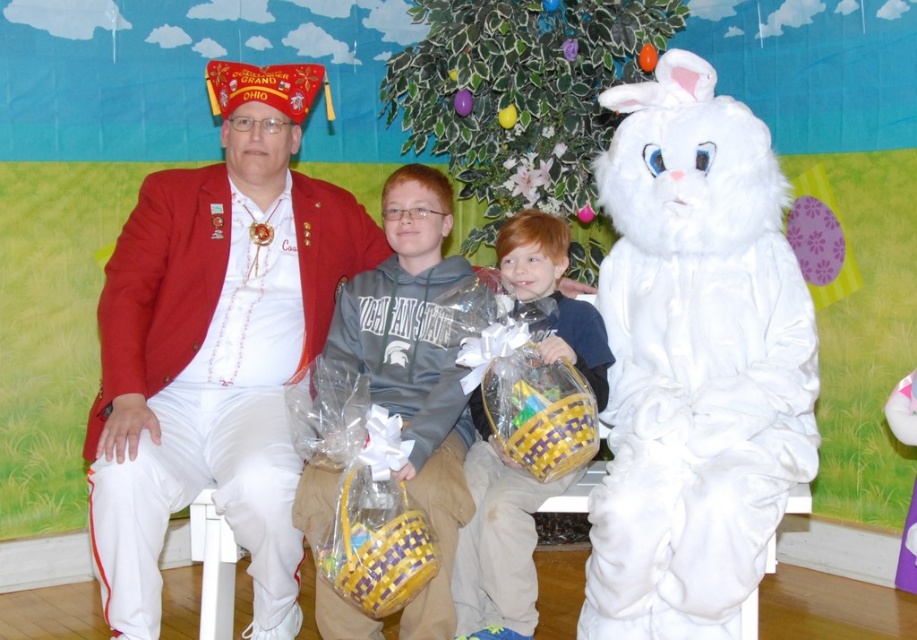
Question: Which of the following is the farthest from the observer?

Choices:
 (A) (648, 246)
 (B) (556, 260)
 (C) (288, 68)
 (D) (427, 340)

Answer: (B)

Question: Which of the following is the closest to the observer?

Choices:
 (A) (164, 381)
 (B) (529, 371)
 (C) (472, 490)

Answer: (B)

Question: Is white fluffy bunny at right smaller than matte red blazer at left?

Choices:
 (A) no
 (B) yes

Answer: (B)

Question: Is white fluffy bunny at right smaller than gray hoodie at center?

Choices:
 (A) no
 (B) yes

Answer: (A)

Question: Does matte red blazer at left have a larger size compared to matte yellow basket at center?

Choices:
 (A) yes
 (B) no

Answer: (A)

Question: Which point is closer to the camera taking this photo?

Choices:
 (A) (407, 634)
 (B) (490, 593)

Answer: (A)